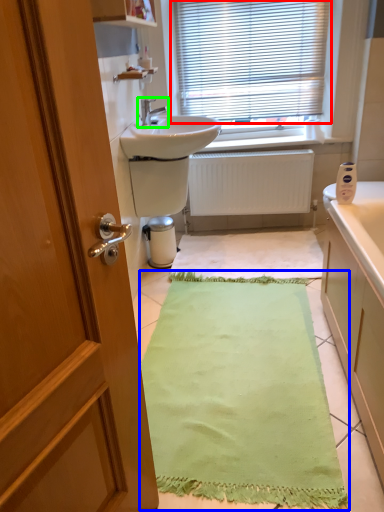
Question: Which is farther away from window blind (highlighted by a red box)? bath mat (highlighted by a blue box) or tap (highlighted by a green box)?

Choices:
 (A) bath mat
 (B) tap

Answer: (A)